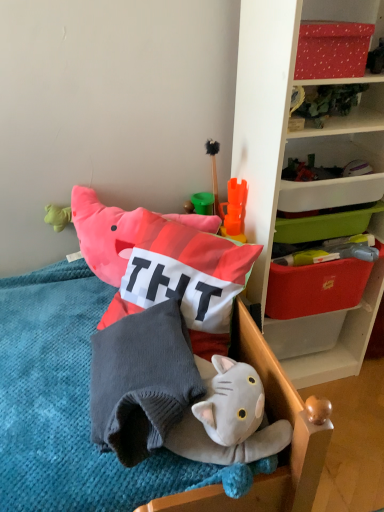
Question: Is red dotted fabric at upper right, positioned as the first storage box in top-to-bottom order, surrounding gray knitted pillow at center?

Choices:
 (A) yes
 (B) no

Answer: (B)

Question: From the image's perspective, is red dotted fabric at upper right, positioned as the first storage box in top-to-bottom order, under gray knitted pillow at center?

Choices:
 (A) no
 (B) yes

Answer: (A)

Question: Does red dotted fabric at upper right, which is the 3th storage box from bottom to top, have a greater height compared to gray knitted pillow at center?

Choices:
 (A) no
 (B) yes

Answer: (A)

Question: Does red dotted fabric at upper right, positioned as the first storage box in top-to-bottom order, touch gray knitted pillow at center?

Choices:
 (A) yes
 (B) no

Answer: (B)

Question: Is red dotted fabric at upper right, positioned as the first storage box in top-to-bottom order, bigger than gray knitted pillow at center?

Choices:
 (A) yes
 (B) no

Answer: (B)

Question: Is soft cotton pillow at center taller or shorter than white plastic shelf at upper right?

Choices:
 (A) tall
 (B) short

Answer: (B)

Question: From a real-world perspective, is soft cotton pillow at center physically located above or below white plastic shelf at upper right?

Choices:
 (A) above
 (B) below

Answer: (B)

Question: In terms of size, does soft cotton pillow at center appear bigger or smaller than white plastic shelf at upper right?

Choices:
 (A) big
 (B) small

Answer: (B)

Question: Is soft cotton pillow at center wider or thinner than white plastic shelf at upper right?

Choices:
 (A) wide
 (B) thin

Answer: (B)

Question: Is red plastic storage box at upper right, which appears as the first storage box when ordered from the bottom, wider or thinner than wooden chair at lower center?

Choices:
 (A) thin
 (B) wide

Answer: (A)

Question: Relative to wooden chair at lower center, is red plastic storage box at upper right, which is counted as the 3th storage box, starting from the top, in front or behind?

Choices:
 (A) behind
 (B) front

Answer: (A)

Question: From the image's perspective, is red plastic storage box at upper right, which appears as the first storage box when ordered from the bottom, above or below wooden chair at lower center?

Choices:
 (A) below
 (B) above

Answer: (B)

Question: Is red plastic storage box at upper right, which appears as the first storage box when ordered from the bottom, inside the boundaries of wooden chair at lower center, or outside?

Choices:
 (A) inside
 (B) outside

Answer: (B)

Question: From a real-world perspective, is wooden chair at lower center positioned above or below red dotted fabric at upper right, positioned as the first storage box in top-to-bottom order?

Choices:
 (A) below
 (B) above

Answer: (A)

Question: Considering their positions, is wooden chair at lower center located in front of or behind red dotted fabric at upper right, positioned as the first storage box in top-to-bottom order?

Choices:
 (A) behind
 (B) front

Answer: (B)